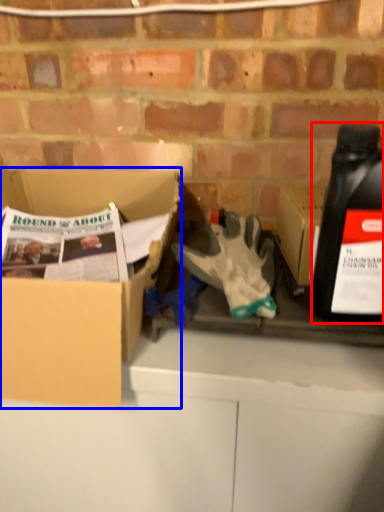
Question: Which object is further to the camera taking this photo, bottle (highlighted by a red box) or box (highlighted by a blue box)?

Choices:
 (A) bottle
 (B) box

Answer: (B)